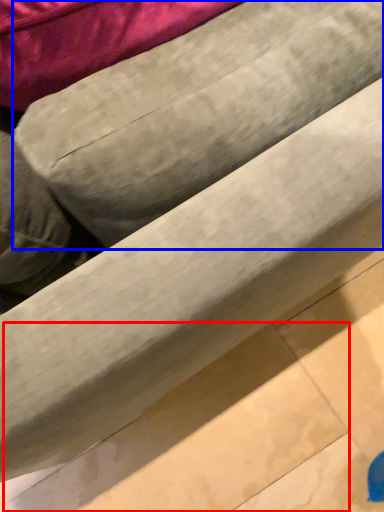
Question: Which object is further to the camera taking this photo, tile (highlighted by a red box) or bean bag chair (highlighted by a blue box)?

Choices:
 (A) tile
 (B) bean bag chair

Answer: (A)